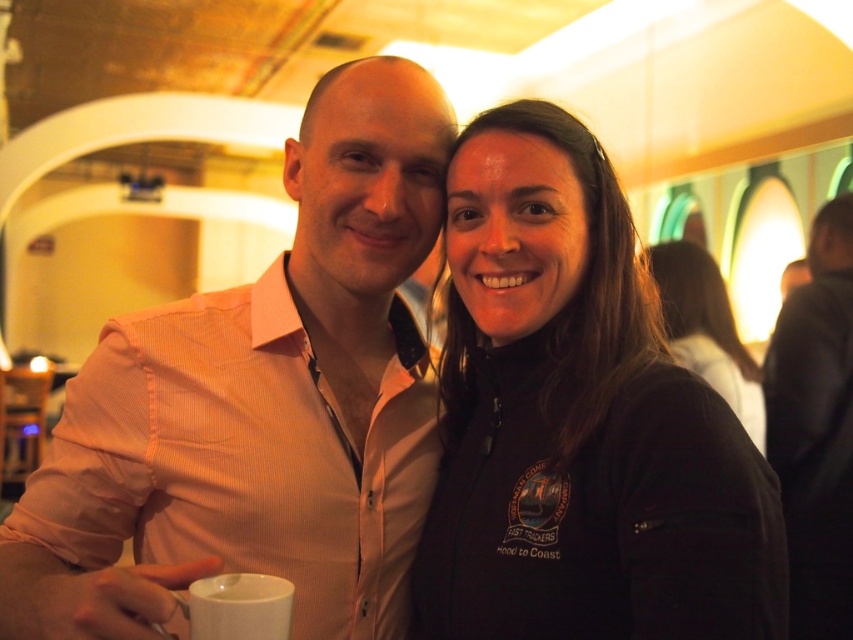
Question: Considering the relative positions of black leather jacket at upper right and black fleece jacket at upper right in the image provided, where is black leather jacket at upper right located with respect to black fleece jacket at upper right?

Choices:
 (A) below
 (B) above

Answer: (A)

Question: Which point appears closest to the camera in this image?

Choices:
 (A) (259, 582)
 (B) (712, 365)
 (C) (383, 352)

Answer: (A)

Question: Does pink shirt at center have a greater width compared to black fleece jacket at center?

Choices:
 (A) yes
 (B) no

Answer: (A)

Question: Based on their relative distances, which object is farther from the white matte mug at lower left?

Choices:
 (A) black fleece jacket at center
 (B) black fleece jacket at upper right

Answer: (B)

Question: Observing the image, what is the correct spatial positioning of black fleece jacket at center in reference to black leather jacket at upper right?

Choices:
 (A) right
 (B) left

Answer: (B)

Question: Which of the following is the closest to the observer?

Choices:
 (A) (843, 556)
 (B) (688, 269)

Answer: (A)